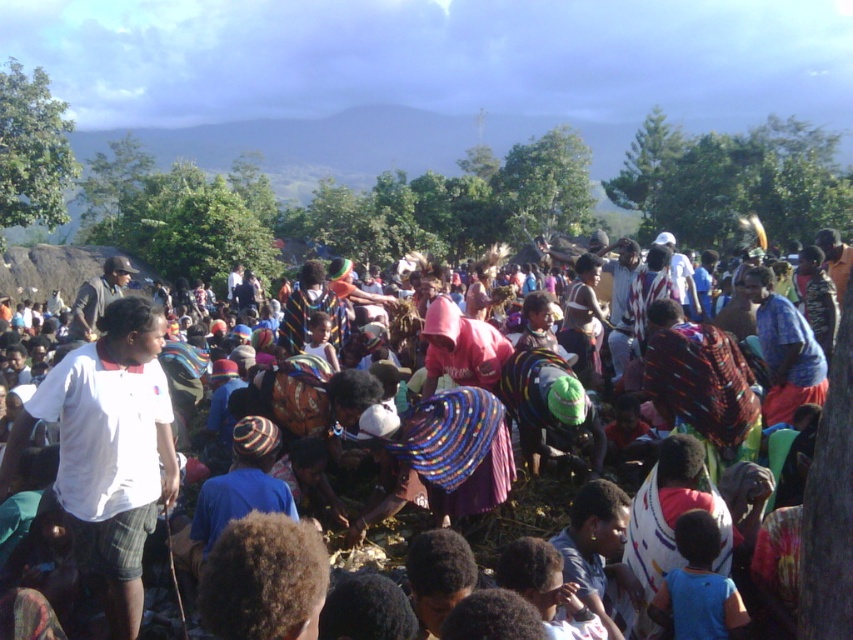
Question: Which point is closer to the camera?

Choices:
 (A) white cotton shirt at center
 (B) multicolored woven fabric at center

Answer: (B)

Question: Which of the following is the closest to the observer?

Choices:
 (A) (811, 600)
 (B) (114, 337)

Answer: (A)

Question: Is white cotton shirt at center in front of multicolored woven fabric at center?

Choices:
 (A) no
 (B) yes

Answer: (A)

Question: Among these points, which one is nearest to the camera?

Choices:
 (A) (148, 468)
 (B) (805, 492)

Answer: (B)

Question: Does white cotton shirt at center have a greater width compared to multicolored woven fabric at center?

Choices:
 (A) no
 (B) yes

Answer: (B)

Question: Is white cotton shirt at center closer to camera compared to multicolored woven fabric at center?

Choices:
 (A) no
 (B) yes

Answer: (A)